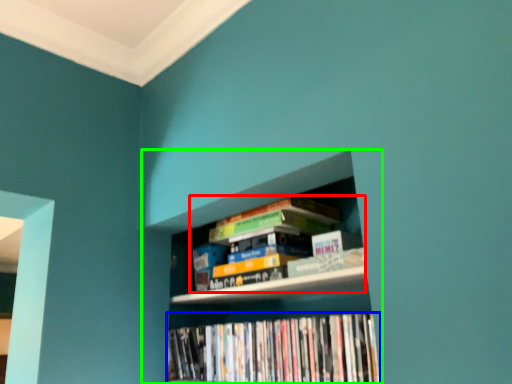
Question: Which is farther away from book (highlighted by a red box)? book (highlighted by a blue box) or bookcase (highlighted by a green box)?

Choices:
 (A) book
 (B) bookcase

Answer: (A)